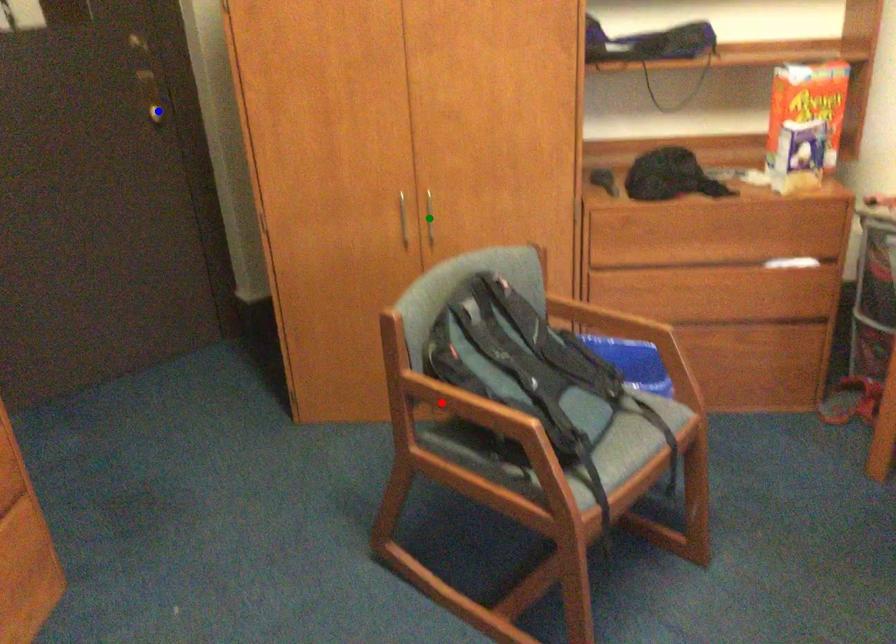
Order these from nearest to farthest:
- red point
- green point
- blue point

red point → green point → blue point